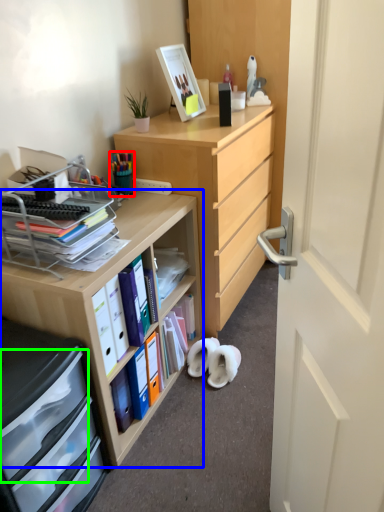
Question: Considering the real-world distances, which object is farthest from stationery (highlighted by a red box)? desk (highlighted by a blue box) or drawer (highlighted by a green box)?

Choices:
 (A) desk
 (B) drawer

Answer: (B)